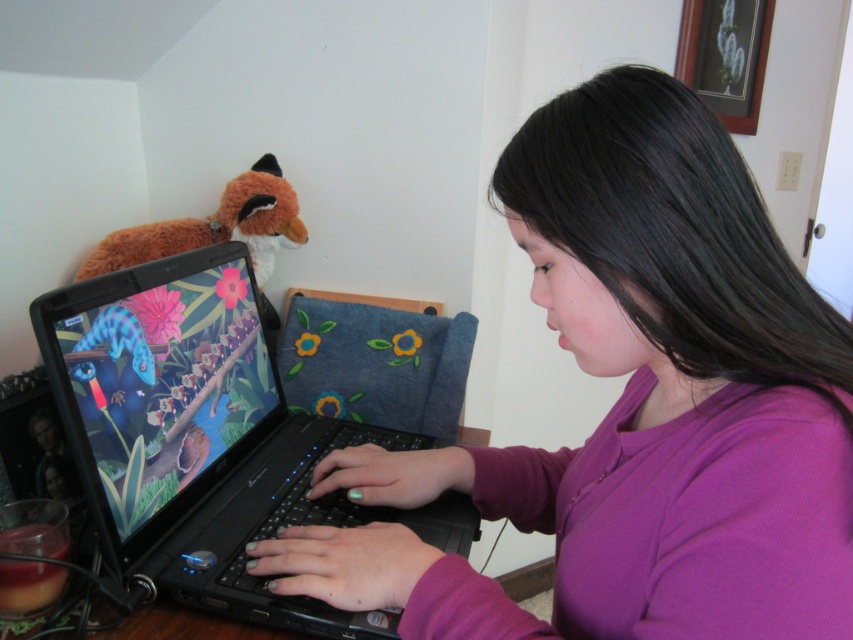
You are a delivery robot with a package that needs to be placed on the desk. The package is 16 inches long. Can you fit it between the black plastic laptop at center and the fuzzy orange fox at upper left without moving either object?

The distance between the black plastic laptop at center and the fuzzy orange fox at upper left is 15.23 inches. Since the package is 16 inches long, it cannot fit in the available space.

You are a delivery robot trying to place a package on the desk. The package is 10 cm wide. The desk has the black plastic laptop at center and the fuzzy orange fox at upper left. Can you place the package between them without moving any items?

The black plastic laptop at center is to the right of the fuzzy orange fox at upper left, so there is space between them. The package is 10 cm wide, so it can be placed between them if the distance between the two objects is at least 10 cm. However, the exact distance isn